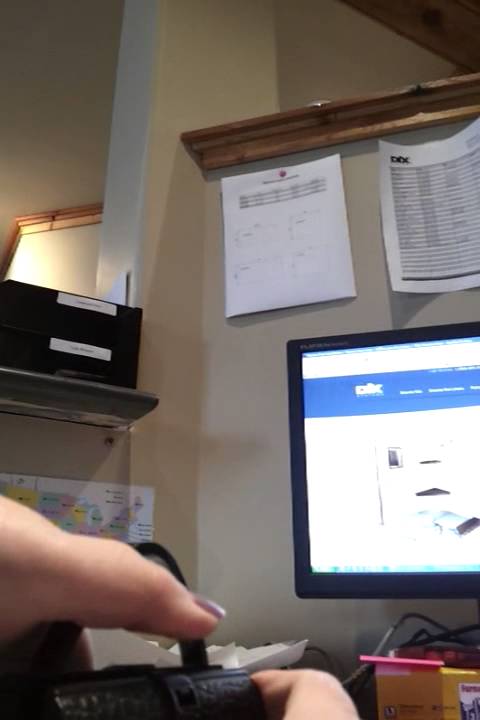
Identify the location of post-it. The width and height of the screenshot is (480, 720). (365, 657).